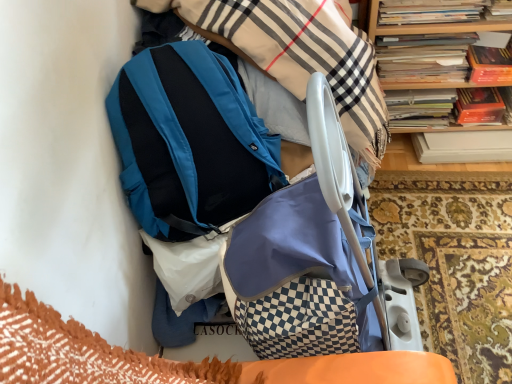
Question: Can you confirm if hardcover book at upper right, which ranks as the 2th book in back-to-front order, is taller than teal matte backpack at upper center?

Choices:
 (A) yes
 (B) no

Answer: (B)

Question: From a real-world perspective, is hardcover book at upper right, positioned as the 1th book in front-to-back order, physically above teal matte backpack at upper center?

Choices:
 (A) yes
 (B) no

Answer: (B)

Question: Does hardcover book at upper right, positioned as the 1th book in front-to-back order, come in front of teal matte backpack at upper center?

Choices:
 (A) yes
 (B) no

Answer: (B)

Question: Can you see hardcover book at upper right, positioned as the 1th book in front-to-back order, touching teal matte backpack at upper center?

Choices:
 (A) yes
 (B) no

Answer: (B)

Question: Is hardcover book at upper right, positioned as the 1th book in front-to-back order, to the right of teal matte backpack at upper center from the viewer's perspective?

Choices:
 (A) yes
 (B) no

Answer: (A)

Question: Is point (350, 340) closer or farther from the camera than point (407, 33)?

Choices:
 (A) farther
 (B) closer

Answer: (B)

Question: Is matte blue baby carriage at center wider or thinner than wooden bookcase at upper right?

Choices:
 (A) wide
 (B) thin

Answer: (A)

Question: Considering their positions, is matte blue baby carriage at center located in front of or behind wooden bookcase at upper right?

Choices:
 (A) front
 (B) behind

Answer: (A)

Question: Is matte blue baby carriage at center inside the boundaries of wooden bookcase at upper right, or outside?

Choices:
 (A) inside
 (B) outside

Answer: (B)

Question: Considering the positions of hardcover books at upper right, placed as the 2th book when sorted from front to back, and teal matte backpack at upper center in the image, is hardcover books at upper right, placed as the 2th book when sorted from front to back, wider or thinner than teal matte backpack at upper center?

Choices:
 (A) wide
 (B) thin

Answer: (B)

Question: In terms of height, does hardcover books at upper right, placed as the 2th book when sorted from front to back, look taller or shorter compared to teal matte backpack at upper center?

Choices:
 (A) tall
 (B) short

Answer: (B)

Question: Would you say hardcover books at upper right, placed as the 2th book when sorted from front to back, is inside or outside teal matte backpack at upper center?

Choices:
 (A) outside
 (B) inside

Answer: (A)

Question: Would you say hardcover books at upper right, placed as the 2th book when sorted from front to back, is to the left or to the right of teal matte backpack at upper center in the picture?

Choices:
 (A) right
 (B) left

Answer: (A)

Question: Would you say matte blue baby carriage at center is inside or outside hardcover books at upper right, placed as the 2th book when sorted from front to back?

Choices:
 (A) inside
 (B) outside

Answer: (B)

Question: From the image's perspective, is matte blue baby carriage at center positioned above or below hardcover books at upper right, which is the first book from back to front?

Choices:
 (A) below
 (B) above

Answer: (A)